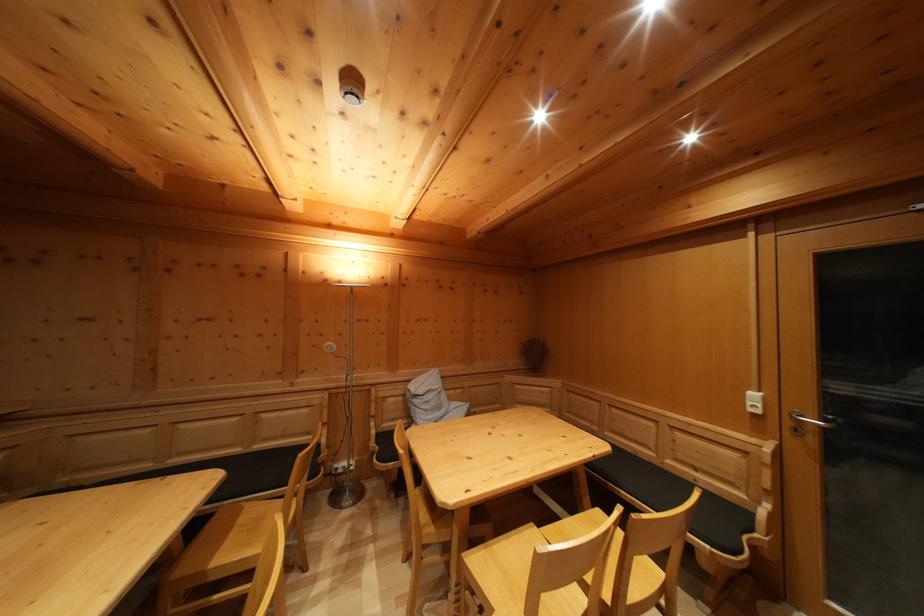
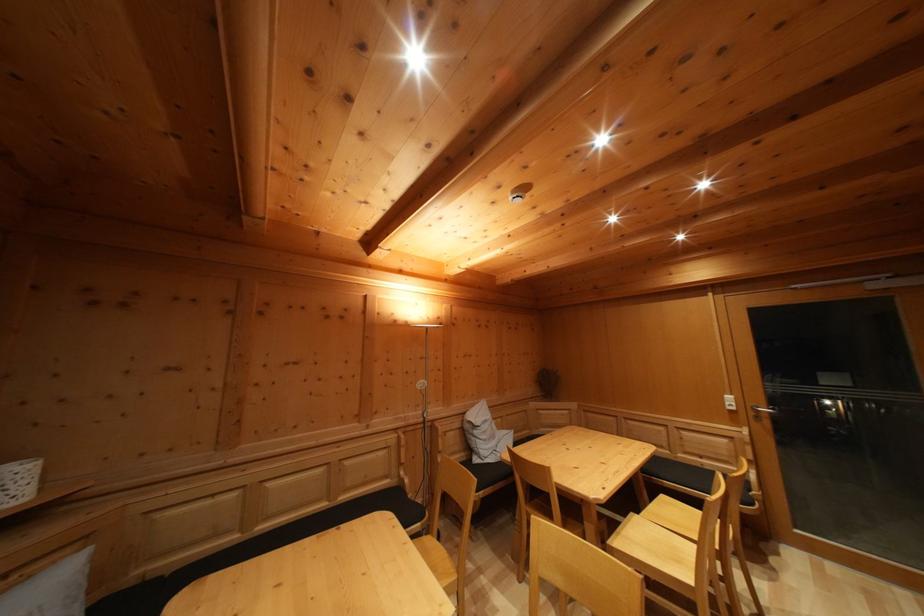
Question: Which direction would the cameraman need to move to produce the second image? Reply with the corresponding letter.

Choices:
 (A) Left
 (B) Right
 (C) Forward
 (D) Backward

Answer: (A)